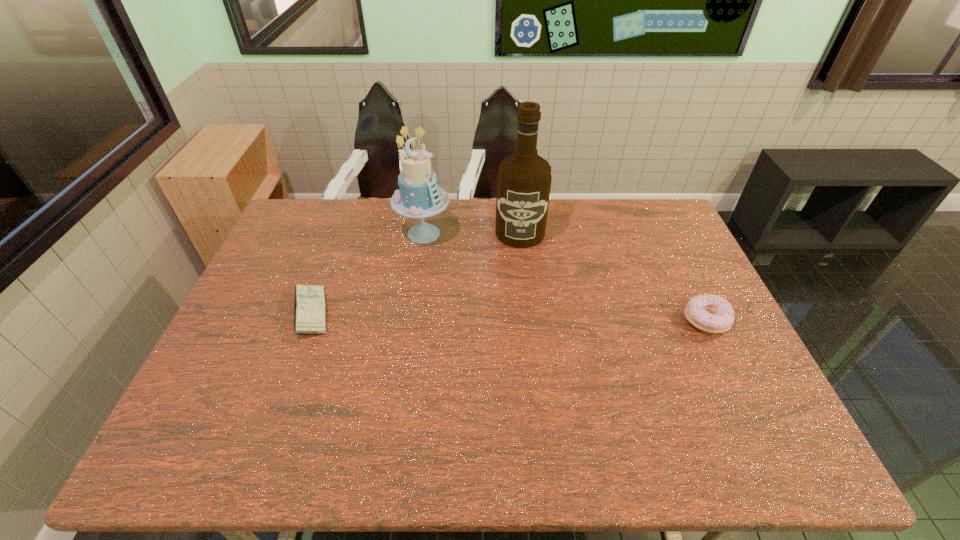
Where is `the leftmost object`? the leftmost object is located at coordinates (309, 304).

Identify the location of the rightmost object. The width and height of the screenshot is (960, 540). (710, 313).

Where is `cake`? The image size is (960, 540). cake is located at coordinates (419, 196).

Locate an element on the screen. Image resolution: width=960 pixels, height=540 pixels. the second tallest object is located at coordinates 419,196.

Image resolution: width=960 pixels, height=540 pixels. In order to click on alcohol in this screenshot , I will do `click(524, 178)`.

Locate an element on the screen. blank space located on the right of the leftmost object is located at coordinates (394, 313).

Locate an element on the screen. vacant space situated on the front of the rightmost object is located at coordinates (728, 367).

At what (x,y) coordinates should I click in order to perform the action: click on vacant position located with a ladder on the side of the second tallest object. Please return your answer as a coordinate pair (x, y). This screenshot has height=540, width=960. Looking at the image, I should click on (462, 320).

Find the location of `vacant position located 0.220m with a ladder on the side of the second tallest object`. vacant position located 0.220m with a ladder on the side of the second tallest object is located at coordinates (451, 296).

At what (x,y) coordinates should I click in order to perform the action: click on vacant point located with a ladder on the side of the second tallest object. Please return your answer as a coordinate pair (x, y). Looking at the image, I should click on (450, 294).